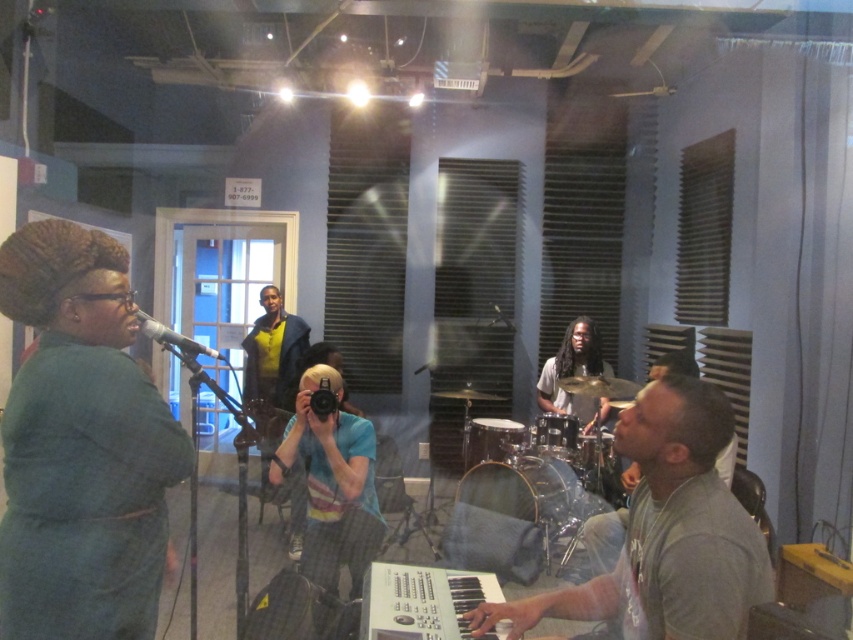
You are a sound engineer in the studio and need to position a microphone stand that is 2.5 meters long between the green matte coat at left and the matte black drum at center. Can the microphone stand fit between them without overlapping?

The green matte coat at left is 3.08 meters from the matte black drum at center. Since the microphone stand is 2.5 meters long, it can fit between them as the distance is greater than the stand length.

Looking at this image, you are a photographer in the studio and need to adjust your camera angle to avoid capturing the green matte coat at left and the matte black microphone at left. Since both are on the left side, which one should you move closer to the center to block the other from view?

The green matte coat at left is larger in size than the matte black microphone at left, so moving it closer to the center would block the microphone from view.